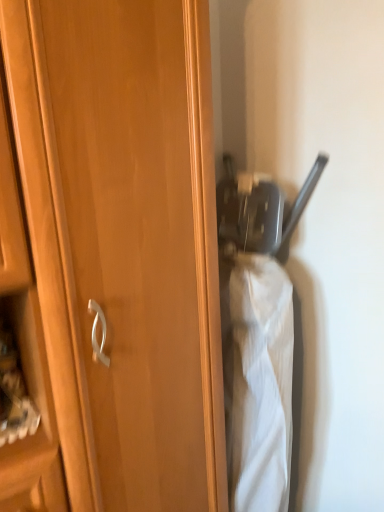
Question: Does wooden cupboard at center have a larger size compared to matte black umbrella at center?

Choices:
 (A) no
 (B) yes

Answer: (B)

Question: Considering the relative sizes of wooden cupboard at center and matte black umbrella at center in the image provided, is wooden cupboard at center wider than matte black umbrella at center?

Choices:
 (A) no
 (B) yes

Answer: (A)

Question: Does wooden cupboard at center have a lesser height compared to matte black umbrella at center?

Choices:
 (A) no
 (B) yes

Answer: (A)

Question: Is there a large distance between wooden cupboard at center and matte black umbrella at center?

Choices:
 (A) yes
 (B) no

Answer: (B)

Question: Can you confirm if wooden cupboard at center is positioned to the left of matte black umbrella at center?

Choices:
 (A) yes
 (B) no

Answer: (A)

Question: Is wooden cupboard at center beside matte black umbrella at center?

Choices:
 (A) no
 (B) yes

Answer: (A)

Question: Is the depth of matte black umbrella at center less than that of wooden cupboard at center?

Choices:
 (A) no
 (B) yes

Answer: (A)

Question: Does matte black umbrella at center appear on the right side of wooden cupboard at center?

Choices:
 (A) no
 (B) yes

Answer: (B)

Question: Is matte black umbrella at center next to wooden cupboard at center?

Choices:
 (A) yes
 (B) no

Answer: (B)

Question: Is matte black umbrella at center behind wooden cupboard at center?

Choices:
 (A) no
 (B) yes

Answer: (B)

Question: Considering the relative positions of matte black umbrella at center and wooden cupboard at center in the image provided, is matte black umbrella at center to the left of wooden cupboard at center from the viewer's perspective?

Choices:
 (A) no
 (B) yes

Answer: (A)

Question: Does matte black umbrella at center turn towards wooden cupboard at center?

Choices:
 (A) yes
 (B) no

Answer: (B)

Question: Is point (261, 284) closer or farther from the camera than point (132, 293)?

Choices:
 (A) farther
 (B) closer

Answer: (A)